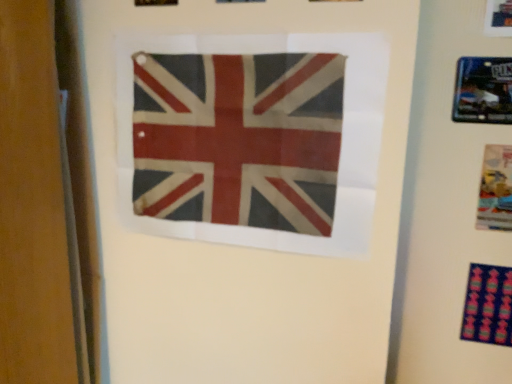
Question: Is metallic blue picture frame at upper right to the right of multicolored fabric at lower right from the viewer's perspective?

Choices:
 (A) no
 (B) yes

Answer: (B)

Question: Is metallic blue picture frame at upper right not near multicolored fabric at lower right?

Choices:
 (A) no
 (B) yes

Answer: (A)

Question: From a real-world perspective, is metallic blue picture frame at upper right positioned over multicolored fabric at lower right based on gravity?

Choices:
 (A) no
 (B) yes

Answer: (B)

Question: Considering the relative sizes of metallic blue picture frame at upper right and multicolored fabric at lower right in the image provided, is metallic blue picture frame at upper right wider than multicolored fabric at lower right?

Choices:
 (A) no
 (B) yes

Answer: (A)

Question: Is multicolored fabric at lower right at the back of metallic blue picture frame at upper right?

Choices:
 (A) no
 (B) yes

Answer: (A)

Question: From the image's perspective, is multicolored fabric at lower right above or below matte plastic poster at right?

Choices:
 (A) below
 (B) above

Answer: (A)

Question: In the image, is multicolored fabric at lower right on the left side or the right side of matte plastic poster at right?

Choices:
 (A) right
 (B) left

Answer: (B)

Question: Considering the positions of multicolored fabric at lower right and matte plastic poster at right in the image, is multicolored fabric at lower right taller or shorter than matte plastic poster at right?

Choices:
 (A) tall
 (B) short

Answer: (B)

Question: Is point (510, 324) positioned closer to the camera than point (484, 190)?

Choices:
 (A) farther
 (B) closer

Answer: (A)

Question: In terms of width, does matte plastic poster at right look wider or thinner when compared to multicolored fabric at lower right?

Choices:
 (A) thin
 (B) wide

Answer: (A)

Question: From a real-world perspective, is matte plastic poster at right positioned above or below multicolored fabric at lower right?

Choices:
 (A) below
 (B) above

Answer: (B)

Question: From the image's perspective, is matte plastic poster at right positioned above or below multicolored fabric at lower right?

Choices:
 (A) below
 (B) above

Answer: (B)

Question: In terms of height, does matte plastic poster at right look taller or shorter compared to multicolored fabric at lower right?

Choices:
 (A) short
 (B) tall

Answer: (B)

Question: Is multicolored fabric at lower right to the left or to the right of metallic blue picture frame at upper right in the image?

Choices:
 (A) left
 (B) right

Answer: (A)

Question: From the image's perspective, is multicolored fabric at lower right above or below metallic blue picture frame at upper right?

Choices:
 (A) below
 (B) above

Answer: (A)